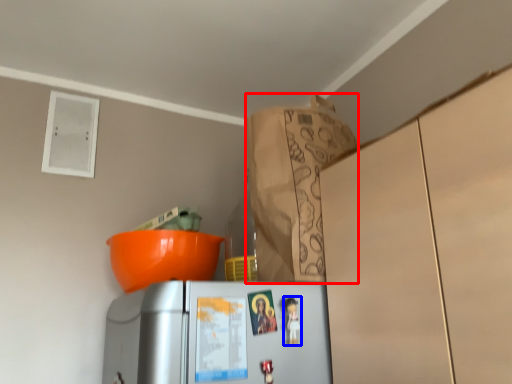
Question: Which point is closer to the camera, paper bag (highlighted by a red box) or toy (highlighted by a blue box)?

Choices:
 (A) paper bag
 (B) toy

Answer: (B)